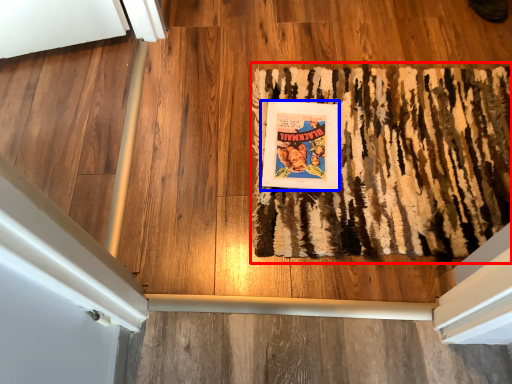
Question: Which object appears closest to the camera in this image, mat (highlighted by a red box) or paperback book (highlighted by a blue box)?

Choices:
 (A) mat
 (B) paperback book

Answer: (A)